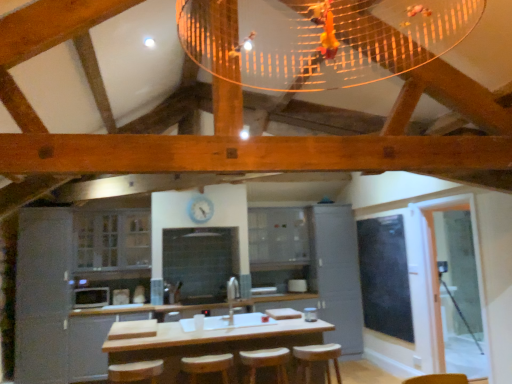
Find the location of a particular element. This screenshot has height=384, width=512. free space above wooden bar stool at center, the second bar stool viewed from the left (from a real-world perspective) is located at coordinates (261, 352).